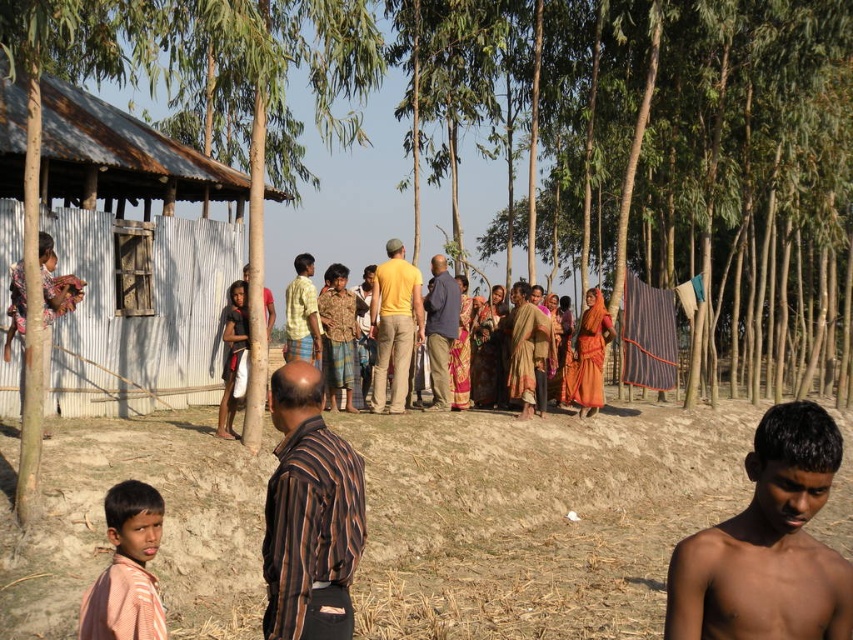
Who is positioned more to the right, brown striped shirt at lower left or dark brown fabric at left?

From the viewer's perspective, brown striped shirt at lower left appears more on the right side.

Which is below, brown striped shirt at lower left or dark brown fabric at left?

brown striped shirt at lower left is lower down.

Where is `brown striped shirt at lower left`? Image resolution: width=853 pixels, height=640 pixels. brown striped shirt at lower left is located at coordinates (126, 568).

Can you confirm if multicolored fabric at center is thinner than dark blue shirt at center?

In fact, multicolored fabric at center might be wider than dark blue shirt at center.

Is multicolored fabric at center further to camera compared to dark blue shirt at center?

No.

Who is more forward, (444, 262) or (430, 324)?

Point (430, 324)

The width and height of the screenshot is (853, 640). Find the location of `multicolored fabric at center`. multicolored fabric at center is located at coordinates (405, 316).

Which of these two, brown wood tree at center or brown striped shirt at center, stands taller?

brown wood tree at center

Which is behind, point (688, 173) or point (323, 536)?

The point (688, 173) is more distant.

Where is `brown wood tree at center`? The image size is (853, 640). brown wood tree at center is located at coordinates (645, 154).